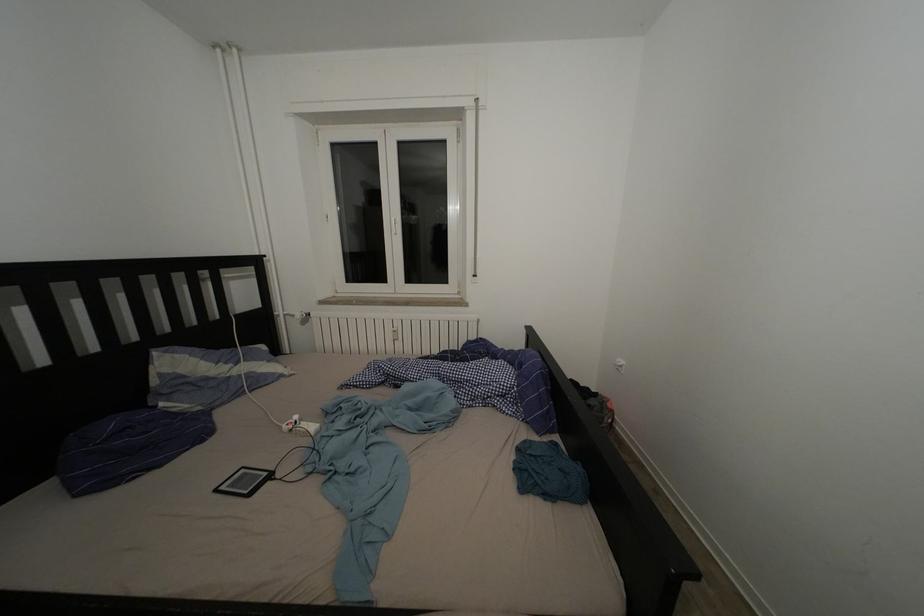
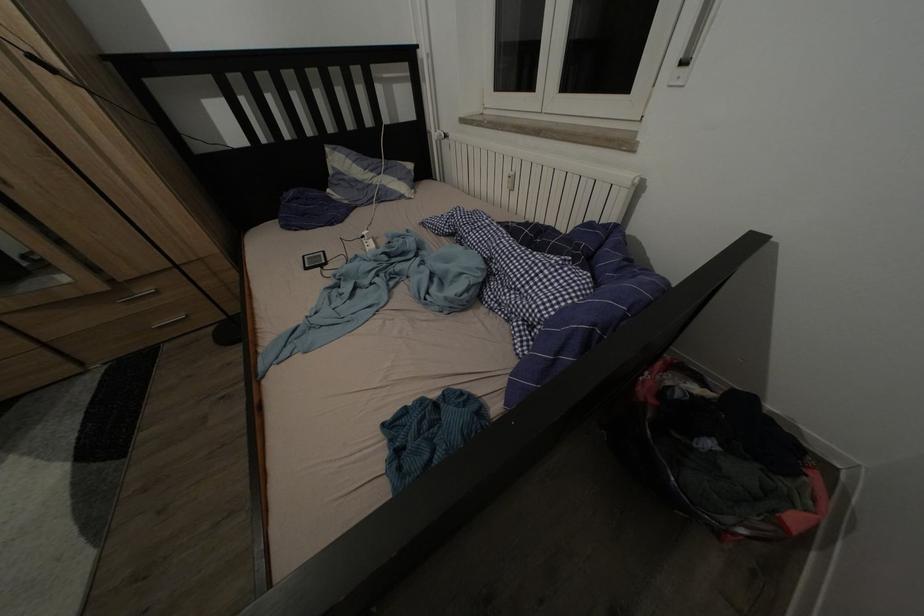
Locate, in the second image, the point that corresponds to point 304,424 in the first image.

(372, 238)